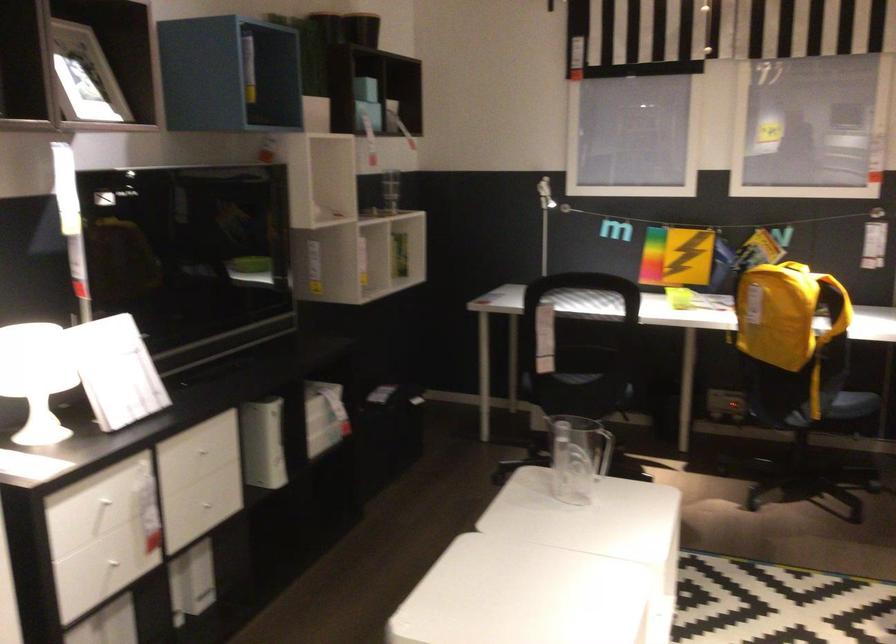
This screenshot has height=644, width=896. Describe the element at coordinates (37, 377) in the screenshot. I see `a white table lamp` at that location.